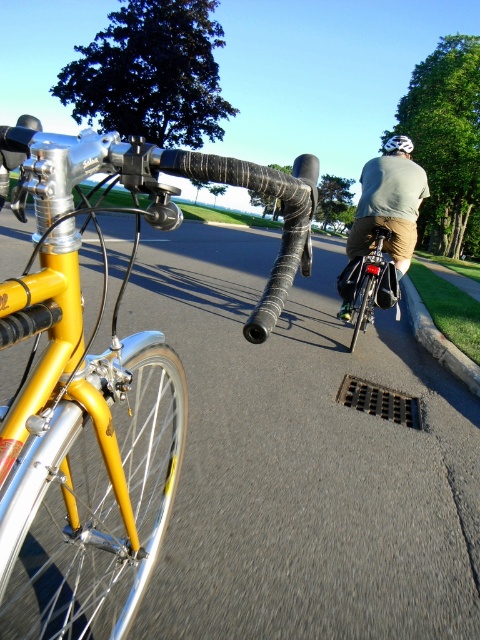
Which is below, light gray fabric shirt at center or matte black bicycle at center?

Positioned lower is matte black bicycle at center.

Is light gray fabric shirt at center further to the viewer compared to matte black bicycle at center?

No, light gray fabric shirt at center is in front of matte black bicycle at center.

Which is in front, point (375, 189) or point (352, 285)?

Positioned in front is point (375, 189).

Where is `light gray fabric shirt at center`? light gray fabric shirt at center is located at coordinates (388, 208).

Does point (72, 593) lie behind point (395, 140)?

No, it is not.

Between point (45, 205) and point (412, 148), which one is positioned behind?

The point (412, 148) is behind.

Locate an element on the screen. Image resolution: width=480 pixels, height=640 pixels. yellow matte bicycle handlebars at center is located at coordinates (101, 387).

Does light gray fabric shirt at center have a greater height compared to white matte helmet at upper center?

No, light gray fabric shirt at center is not taller than white matte helmet at upper center.

Does light gray fabric shirt at center appear under white matte helmet at upper center?

Yes, light gray fabric shirt at center is below white matte helmet at upper center.

What do you see at coordinates (388, 208) in the screenshot? The height and width of the screenshot is (640, 480). I see `light gray fabric shirt at center` at bounding box center [388, 208].

The width and height of the screenshot is (480, 640). What are the coordinates of `light gray fabric shirt at center` in the screenshot? It's located at (388, 208).